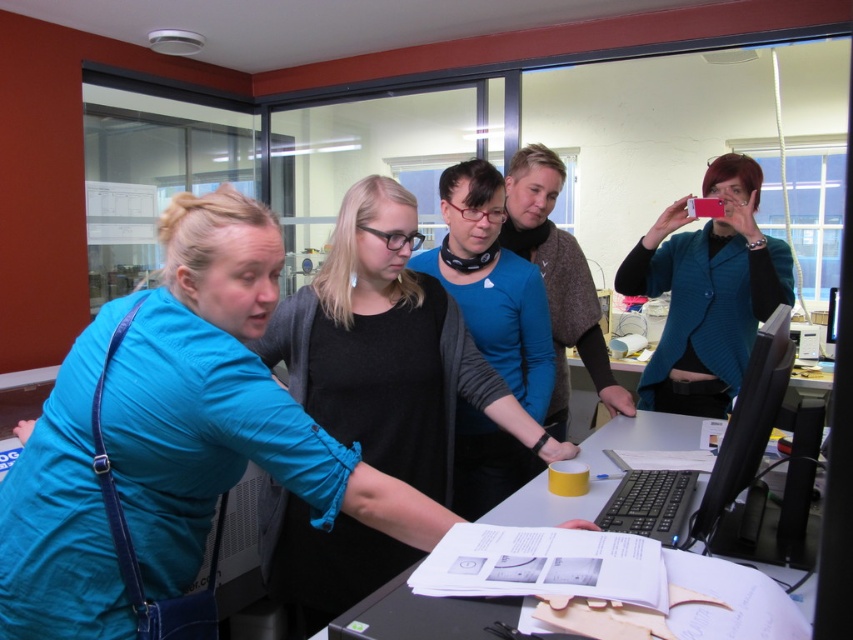
Is matte black shirt at center positioned at the back of blue sweater at center?

No, it is not.

Describe the element at coordinates (492, 284) in the screenshot. I see `matte black shirt at center` at that location.

What do you see at coordinates (492, 284) in the screenshot?
I see `matte black shirt at center` at bounding box center [492, 284].

This screenshot has height=640, width=853. I want to click on matte black shirt at center, so click(x=492, y=284).

Which is more to the left, matte black shirt at center or white plastic table at center?

matte black shirt at center is more to the left.

Can you confirm if matte black shirt at center is thinner than white plastic table at center?

Indeed, matte black shirt at center has a lesser width compared to white plastic table at center.

Locate an element on the screen. Image resolution: width=853 pixels, height=640 pixels. matte black shirt at center is located at coordinates (492, 284).

Which is in front, point (712, 337) or point (498, 518)?

Point (498, 518) is in front.

Does point (752, 198) come behind point (466, 602)?

Yes.

Which is in front, point (706, 316) or point (492, 636)?

Positioned in front is point (492, 636).

This screenshot has width=853, height=640. Find the location of `teal textured blazer at upper right`. teal textured blazer at upper right is located at coordinates (706, 291).